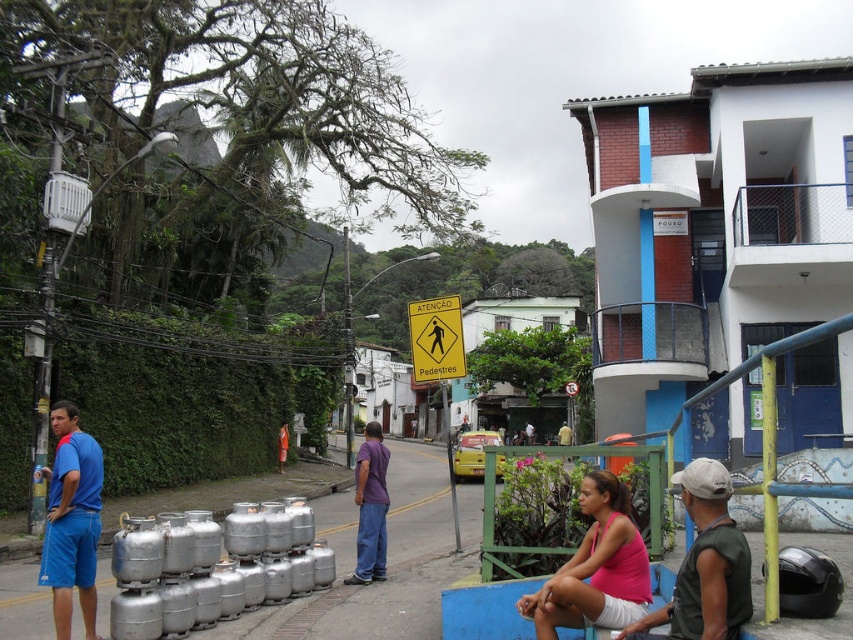
Is green sleeveless shirt at lower right thinner than purple matte shirt at center?

Yes.

Who is shorter, green sleeveless shirt at lower right or purple matte shirt at center?

Standing shorter between the two is green sleeveless shirt at lower right.

Measure the distance between green sleeveless shirt at lower right and camera.

green sleeveless shirt at lower right and camera are 3.49 meters apart.

Identify the location of green sleeveless shirt at lower right. Image resolution: width=853 pixels, height=640 pixels. (705, 564).

Between green sleeveless shirt at lower right and blue fabric shirt at left, which one appears on the right side from the viewer's perspective?

From the viewer's perspective, green sleeveless shirt at lower right appears more on the right side.

Does green sleeveless shirt at lower right appear on the left side of blue fabric shirt at left?

In fact, green sleeveless shirt at lower right is to the right of blue fabric shirt at left.

Which is in front, point (744, 588) or point (99, 480)?

Point (744, 588) is more forward.

Find the location of a particular element. green sleeveless shirt at lower right is located at coordinates (705, 564).

Based on the photo, is blue fabric shirt at left further to the viewer compared to purple matte shirt at center?

That is False.

Describe the element at coordinates (71, 520) in the screenshot. I see `blue fabric shirt at left` at that location.

The width and height of the screenshot is (853, 640). Identify the location of blue fabric shirt at left. (71, 520).